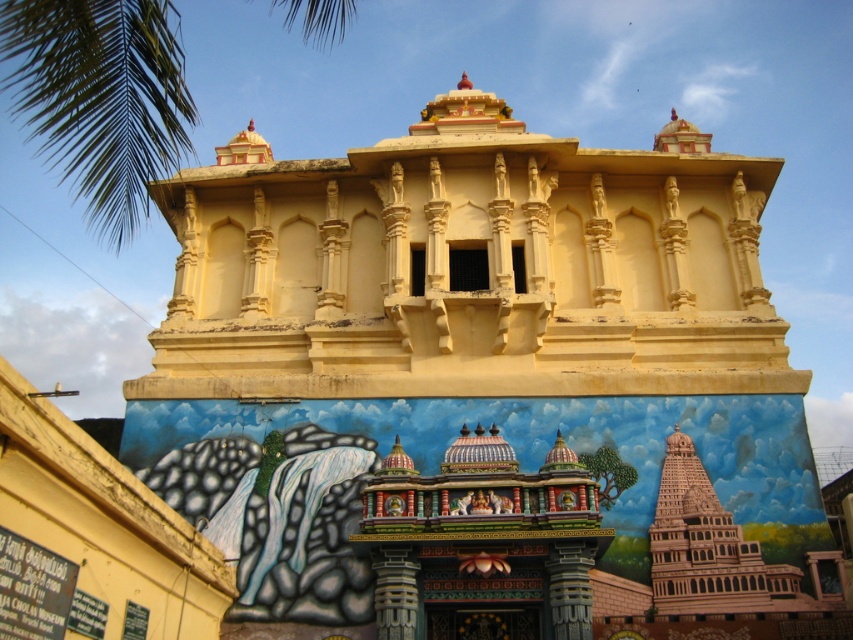
You are an architect designing a new garden layout. You want to place a statue exactly halfway between the matte yellow hindu temple at center and the green leafy palm tree at upper left. Where would you position the statue?

The statue should be placed halfway between the matte yellow hindu temple at center and the green leafy palm tree at upper left, directly in the middle of the two objects.

Consider the image. You are standing in front of the traditional Indian architectural structure described. There is a matte yellow hindu temple at center. If you want to take a photo of the temple, where should you position yourself relative to the temple to capture it in the center of your camera frame?

You should position yourself directly in front of the matte yellow hindu temple at center to ensure it is centered in your camera frame, as it is already located at the central point of the scene.